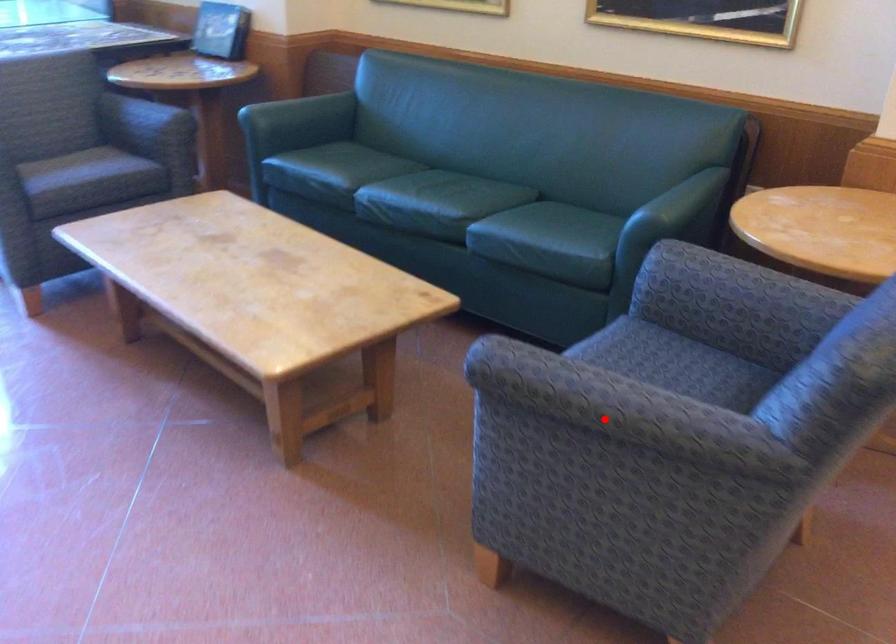
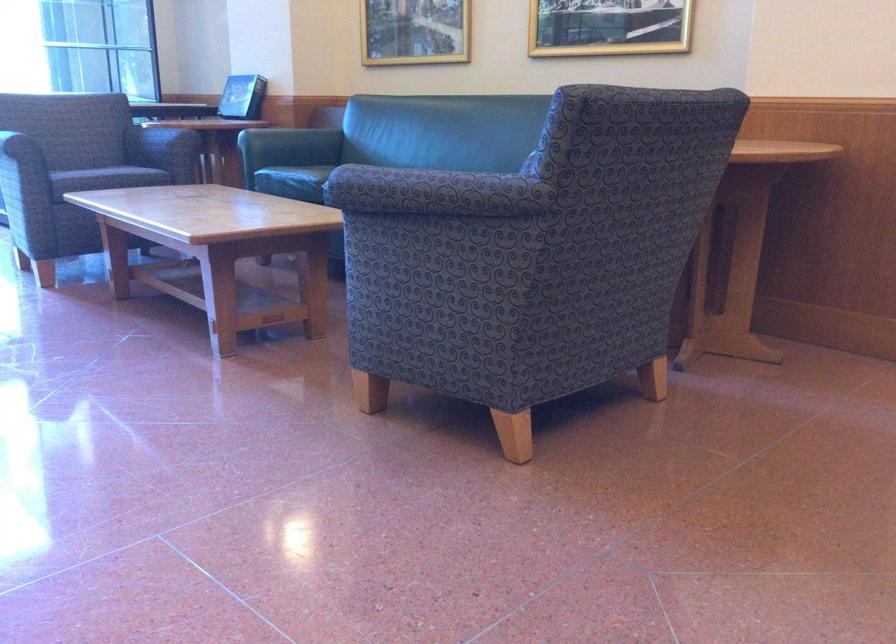
Question: I am providing you with two images of the same scene from different viewpoints. In image1, a red point is highlighted. Considering the same 3D point in image2, which of the following is correct?

Choices:
 (A) It is closer
 (B) It is farther

Answer: (B)